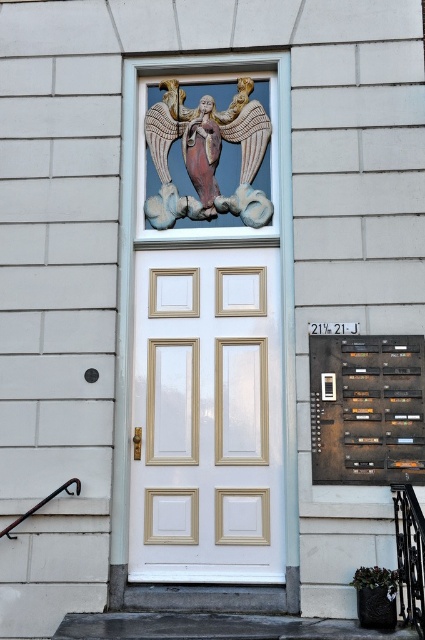
Who is taller, white painted wood door at center or dark brown wooden plaque at lower right?

With more height is white painted wood door at center.

Locate an element on the screen. This screenshot has height=640, width=425. white painted wood door at center is located at coordinates (206, 417).

From the picture: How far apart are white painted wood door at center and black wrought iron balustrade at lower right?

white painted wood door at center is 4.22 feet from black wrought iron balustrade at lower right.

Which of these two, white painted wood door at center or black wrought iron balustrade at lower right, stands taller?

With more height is white painted wood door at center.

What do you see at coordinates (206, 417) in the screenshot?
I see `white painted wood door at center` at bounding box center [206, 417].

At what (x,y) coordinates should I click in order to perform the action: click on white painted wood door at center. Please return your answer as a coordinate pair (x, y). Looking at the image, I should click on (206, 417).

Is polychrome stone angel at upper center shorter than black wrought iron balustrade at lower right?

No.

Can you confirm if polychrome stone angel at upper center is taller than black wrought iron balustrade at lower right?

Indeed, polychrome stone angel at upper center has a greater height compared to black wrought iron balustrade at lower right.

What do you see at coordinates (206, 156) in the screenshot? I see `polychrome stone angel at upper center` at bounding box center [206, 156].

This screenshot has height=640, width=425. In order to click on polychrome stone angel at upper center in this screenshot , I will do `click(206, 156)`.